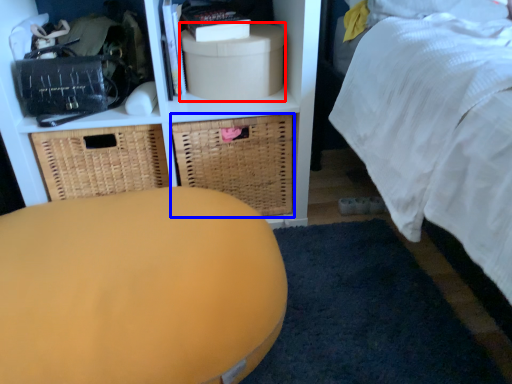
Question: Which point is further to the camera, storage box (highlighted by a red box) or basket (highlighted by a blue box)?

Choices:
 (A) storage box
 (B) basket

Answer: (B)